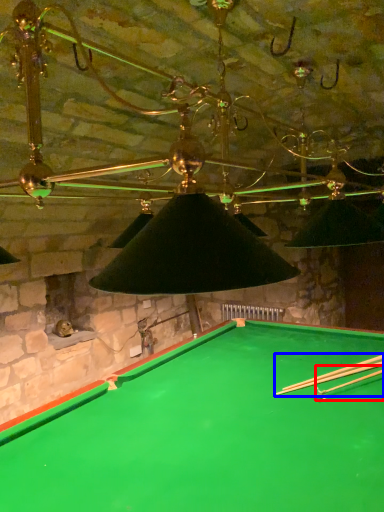
Question: Which point is closer to the camera, cue (highlighted by a red box) or cue (highlighted by a blue box)?

Choices:
 (A) cue
 (B) cue

Answer: (A)